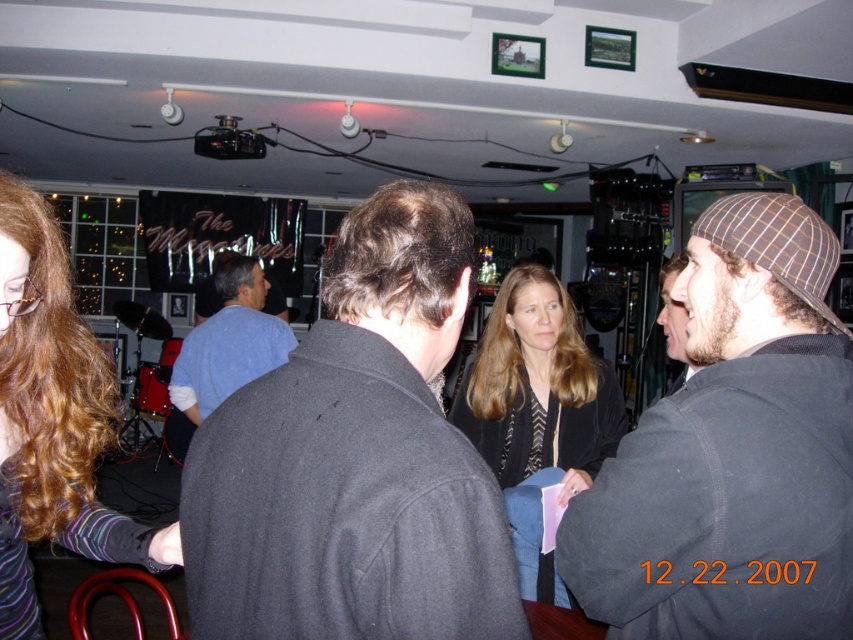
Looking at this image, is shiny brown hair at lower left closer to camera compared to matte black jacket at center?

Yes, it is.

Between shiny brown hair at lower left and matte black jacket at center, which one appears on the left side from the viewer's perspective?

Positioned to the left is shiny brown hair at lower left.

You are a GUI agent. You are given a task and a screenshot of the screen. Output one action in this format:
    pyautogui.click(x=<x>, y=<y>)
    Task: Click on the shiny brown hair at lower left
    Image resolution: width=853 pixels, height=640 pixels.
    Given the screenshot: What is the action you would take?
    pyautogui.click(x=51, y=419)

Which is below, dark gray wool coat at center or blue cotton shirt at center?

blue cotton shirt at center

Can you confirm if dark gray wool coat at center is positioned to the right of blue cotton shirt at center?

Yes, dark gray wool coat at center is to the right of blue cotton shirt at center.

What do you see at coordinates (355, 458) in the screenshot? I see `dark gray wool coat at center` at bounding box center [355, 458].

This screenshot has width=853, height=640. I want to click on dark gray wool coat at center, so click(355, 458).

Between dark gray wool coat at center and dark gray knit hat at right, which one is positioned higher?

Positioned higher is dark gray wool coat at center.

Which of these two, dark gray wool coat at center or dark gray knit hat at right, stands taller?

dark gray knit hat at right is taller.

Between point (345, 534) and point (700, 330), which one is positioned in front?

Positioned in front is point (345, 534).

Where is `dark gray wool coat at center`? The width and height of the screenshot is (853, 640). dark gray wool coat at center is located at coordinates (355, 458).